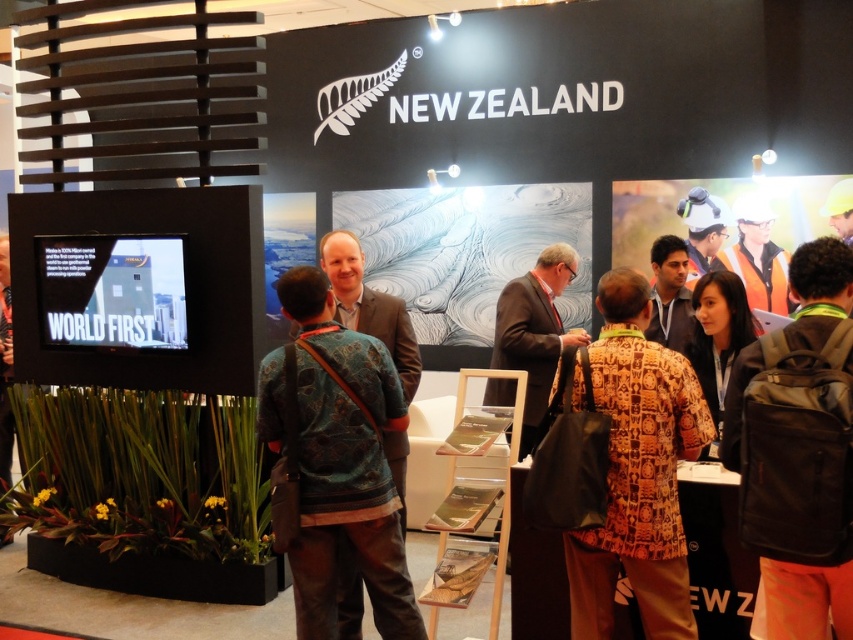
Between matte brown suit at center and orange safety vest at center, which one is positioned higher?

orange safety vest at center

Can you confirm if matte brown suit at center is taller than orange safety vest at center?

Indeed, matte brown suit at center has a greater height compared to orange safety vest at center.

What do you see at coordinates (369, 305) in the screenshot? I see `matte brown suit at center` at bounding box center [369, 305].

Identify the location of matte brown suit at center. The height and width of the screenshot is (640, 853). (369, 305).

Is brown patterned shirt at center thinner than matte brown suit at center?

In fact, brown patterned shirt at center might be wider than matte brown suit at center.

Is point (630, 404) positioned in front of point (368, 300)?

Yes, point (630, 404) is in front of point (368, 300).

Who is more forward, (659, 429) or (386, 321)?

Point (659, 429) is more forward.

Where is `brown patterned shirt at center`? The image size is (853, 640). brown patterned shirt at center is located at coordinates (637, 472).

Find the location of `brown patterned shirt at center`. brown patterned shirt at center is located at coordinates (637, 472).